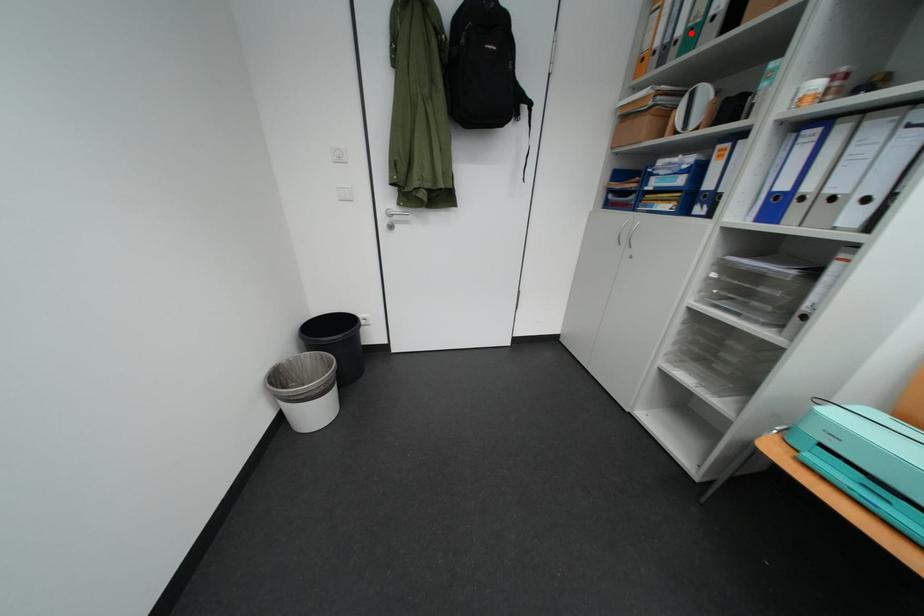
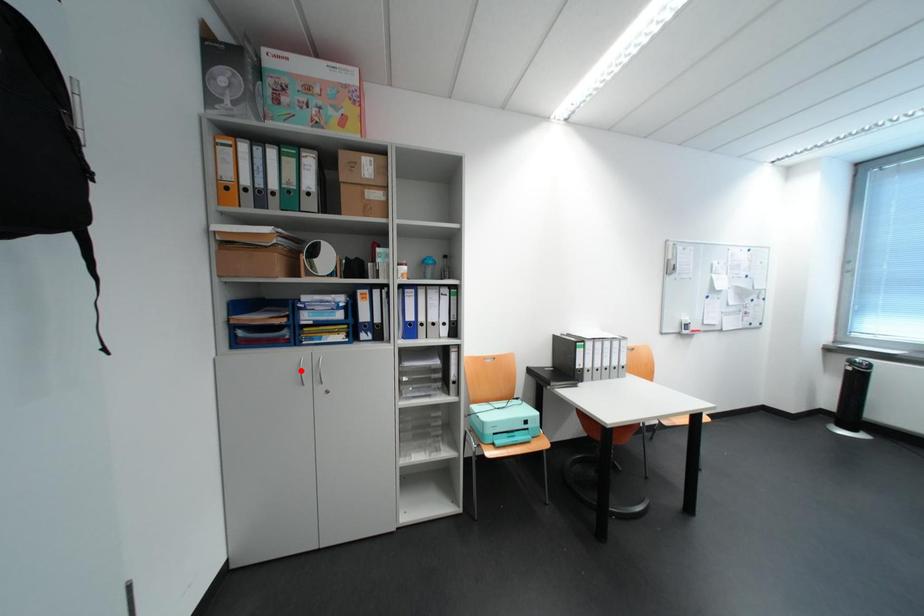
I am providing you with two images of the same scene from different viewpoints. A red point is marked on the first image and another point is marked on the second image. Are the points marked in image1 and image2 representing the same 3D position?

No